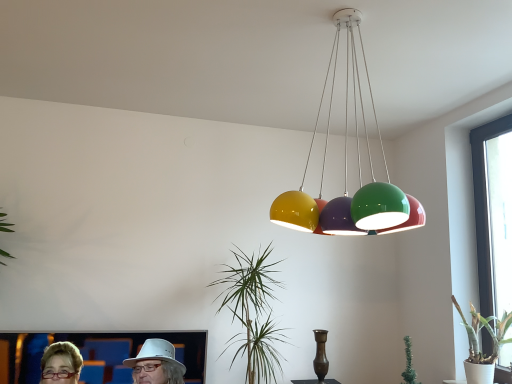
Question: From the image's perspective, is white ceramic pot at lower right, arranged as the first houseplant when viewed from the right, above or below glossy multicolored globe lights at upper center?

Choices:
 (A) above
 (B) below

Answer: (B)

Question: Based on their positions, is white ceramic pot at lower right, arranged as the first houseplant when viewed from the right, located to the left or right of glossy multicolored globe lights at upper center?

Choices:
 (A) right
 (B) left

Answer: (A)

Question: Considering the real-world distances, which object is closest to the bronze metallic vase at center?

Choices:
 (A) transparent glass window at right
 (B) green glossy plant at center, which ranks as the 2th houseplant in right-to-left order
 (C) glossy multicolored globe lights at upper center
 (D) white ceramic pot at lower right, which ranks as the 2th houseplant in left-to-right order
 (E) matte white hat at lower left

Answer: (B)

Question: Estimate the real-world distances between objects in this image. Which object is closer to the white ceramic pot at lower right, arranged as the first houseplant when viewed from the right?

Choices:
 (A) bronze metallic vase at center
 (B) matte white hat at lower left
 (C) transparent glass window at right
 (D) glossy multicolored globe lights at upper center
 (E) green glossy plant at center, which ranks as the 2th houseplant in right-to-left order

Answer: (C)